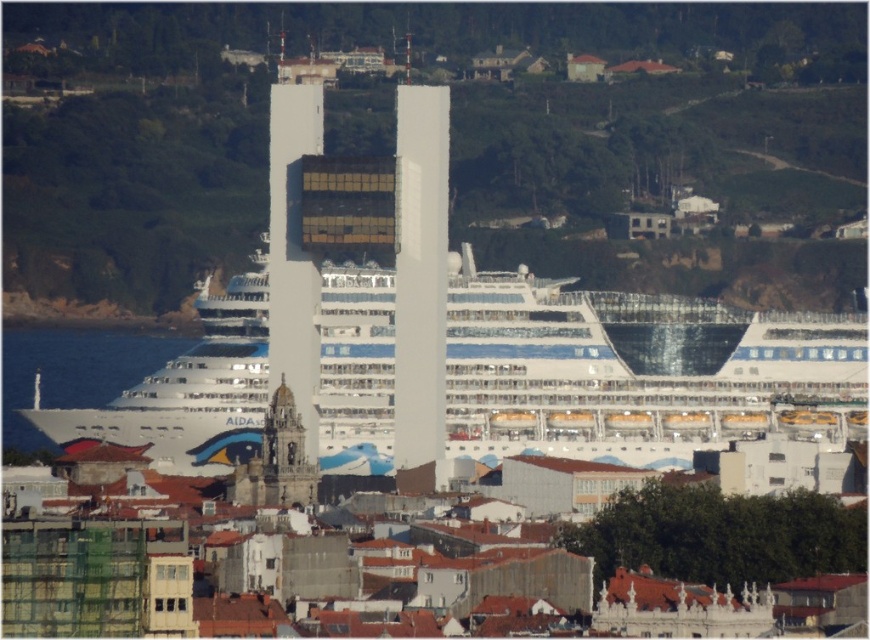
Between point (480, 394) and point (423, 467), which one is positioned behind?

Positioned behind is point (423, 467).

In the scene shown: How distant is white glossy cruise ship at center from white glossy building at center?

A distance of 27.10 meters exists between white glossy cruise ship at center and white glossy building at center.

Which is in front, point (800, 378) or point (419, 248)?

Point (419, 248)

Identify the location of white glossy cruise ship at center. The width and height of the screenshot is (870, 640). (636, 371).

Who is more distant from viewer, (409, 188) or (10, 401)?

The point (10, 401) is more distant.

Does white glossy building at center appear over white glossy water at lower left?

Yes, white glossy building at center is above white glossy water at lower left.

Measure the distance between point (415, 298) and camera.

They are 639.61 meters apart.

Find the location of a particular element. The width and height of the screenshot is (870, 640). white glossy building at center is located at coordinates (420, 284).

Who is more forward, (378,269) or (22,364)?

Positioned in front is point (378,269).

The height and width of the screenshot is (640, 870). Describe the element at coordinates (636, 371) in the screenshot. I see `white glossy cruise ship at center` at that location.

The width and height of the screenshot is (870, 640). I want to click on white glossy cruise ship at center, so click(x=636, y=371).